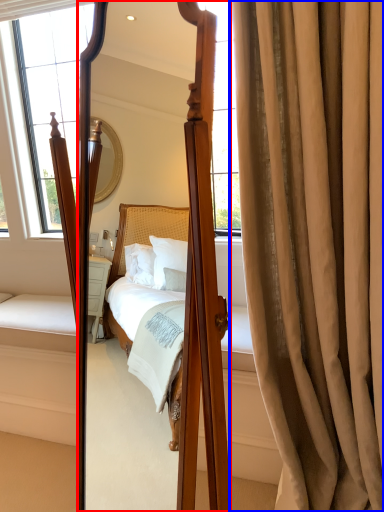
Question: Which of the following is the closest to the observer, mirror (highlighted by a red box) or curtain (highlighted by a blue box)?

Choices:
 (A) mirror
 (B) curtain

Answer: (A)